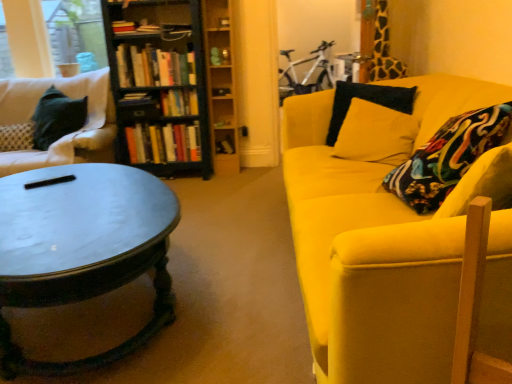
I want to click on vacant space that is in between wooden shelf at center, arranged as the first shelf when ordered from the bottom, and matte black coffee table at left, so click(x=212, y=220).